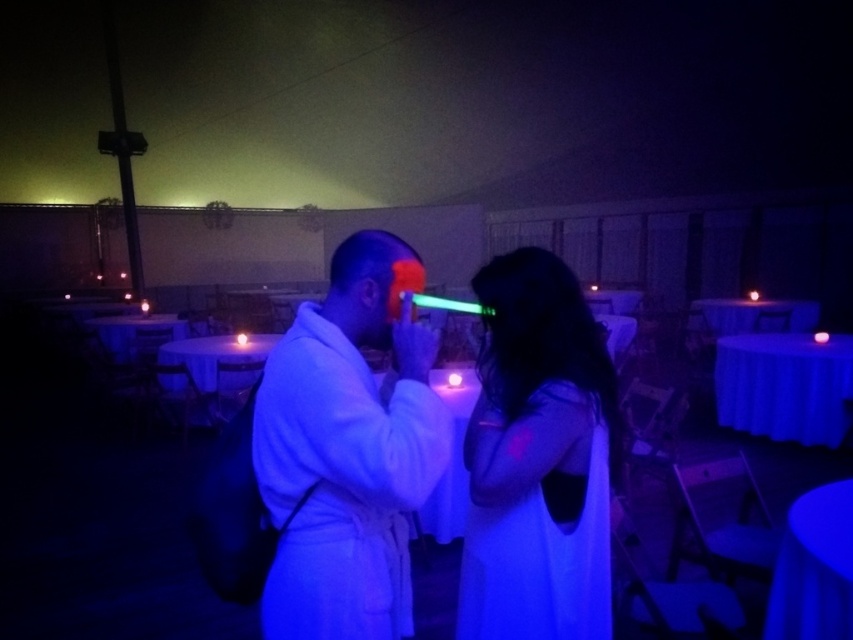
You are standing at the center of the hall and see two points marked in the scene. The first point is labeled as point (335, 596) and the second is point (572, 554). Which point is closer to you?

Point (335, 596) is closer to you because it is in front of point (572, 554).

You are a photographer at the event and want to capture both the white matte bathrobe at center and the matte black dress at center in a single frame. Which clothing item should you focus on first to ensure both are in the frame?

The white matte bathrobe at center is much taller than the matte black dress at center, so focusing on the white matte bathrobe at center first will ensure the matte black dress at center is also in the frame.